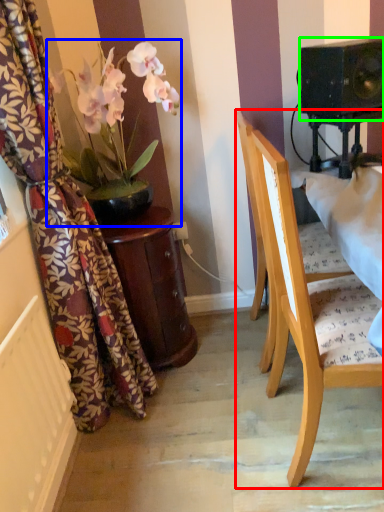
Question: Considering the real-world distances, which object is farthest from chair (highlighted by a red box)? houseplant (highlighted by a blue box) or speaker (highlighted by a green box)?

Choices:
 (A) houseplant
 (B) speaker

Answer: (A)